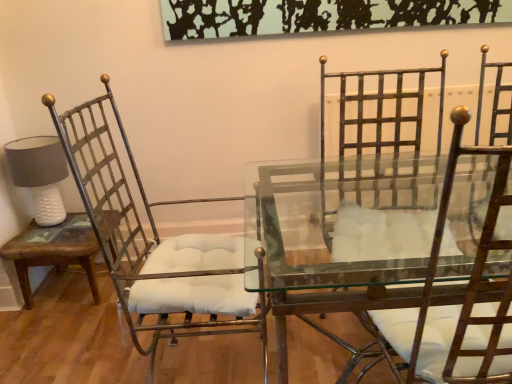
Locate an element on the screen. The width and height of the screenshot is (512, 384). unoccupied area in front of white textured lampshade at left is located at coordinates (37, 244).